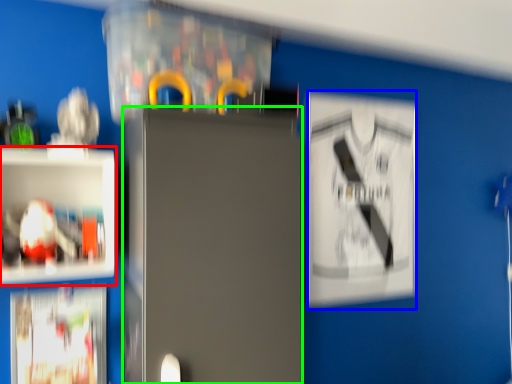
Question: Considering the real-world distances, which object is closest to shelf (highlighted by a red box)? poster (highlighted by a blue box) or fridge (highlighted by a green box).

Choices:
 (A) poster
 (B) fridge

Answer: (B)